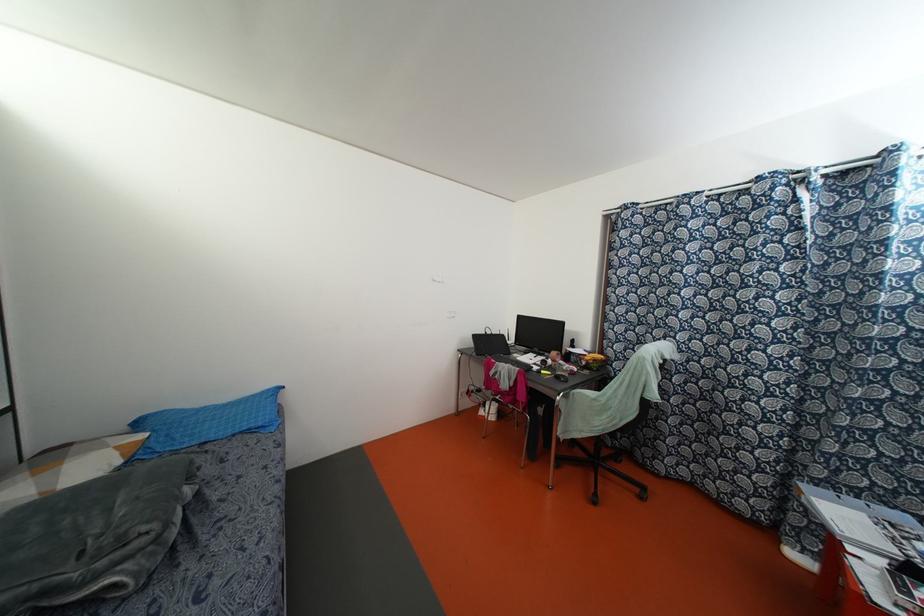
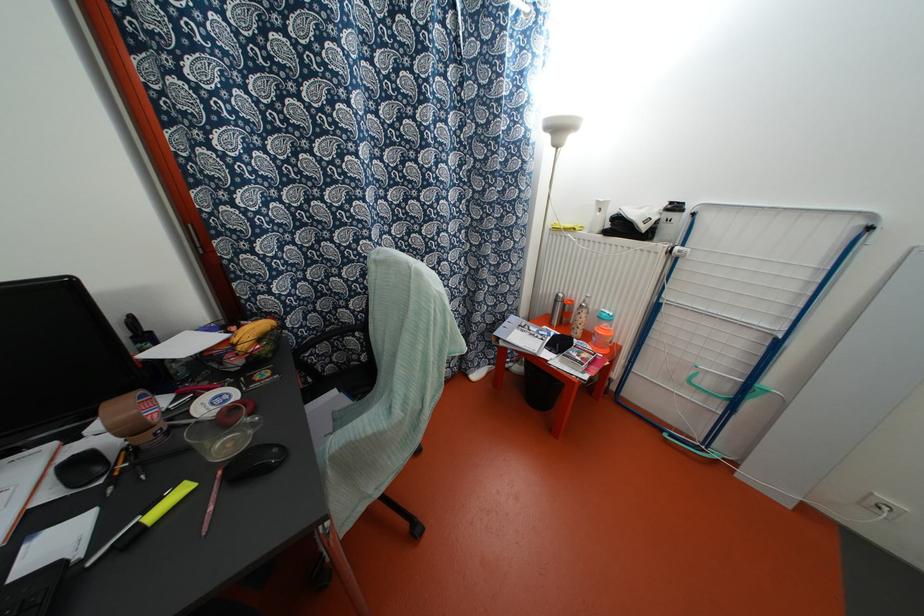
Locate, in the second image, the point that corresponds to point (542, 371) in the first image.

(152, 515)